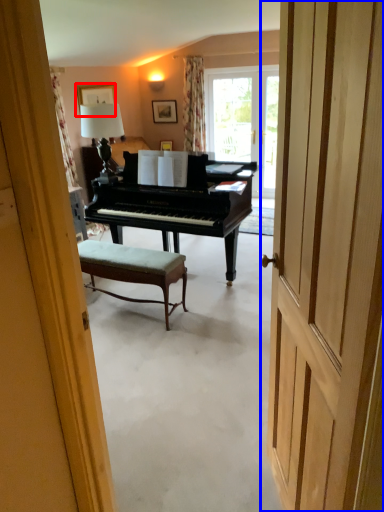
Question: Which object is closer to the camera taking this photo, picture frame (highlighted by a red box) or door (highlighted by a blue box)?

Choices:
 (A) picture frame
 (B) door

Answer: (B)